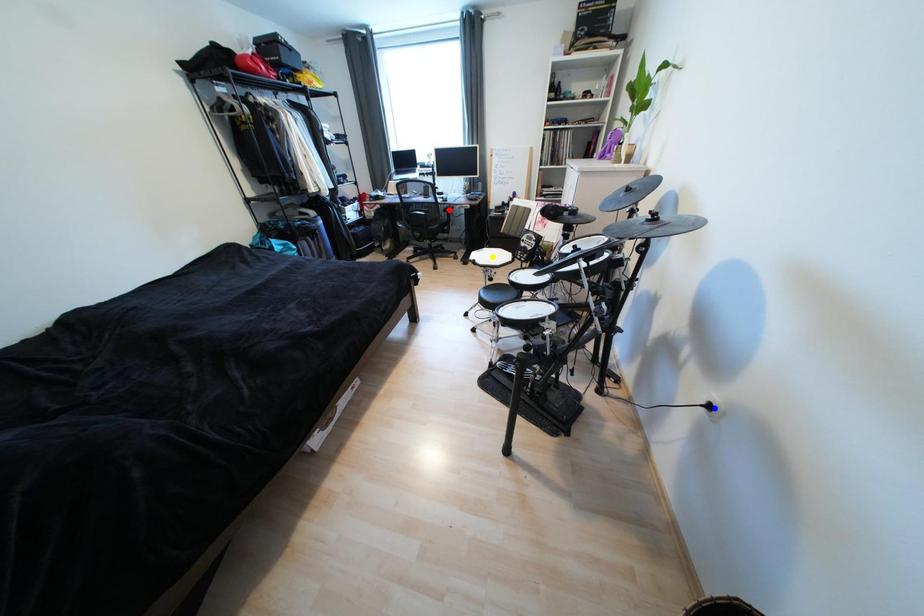
Order these from nearest to farthest:
yellow point, red point, blue point

blue point → yellow point → red point